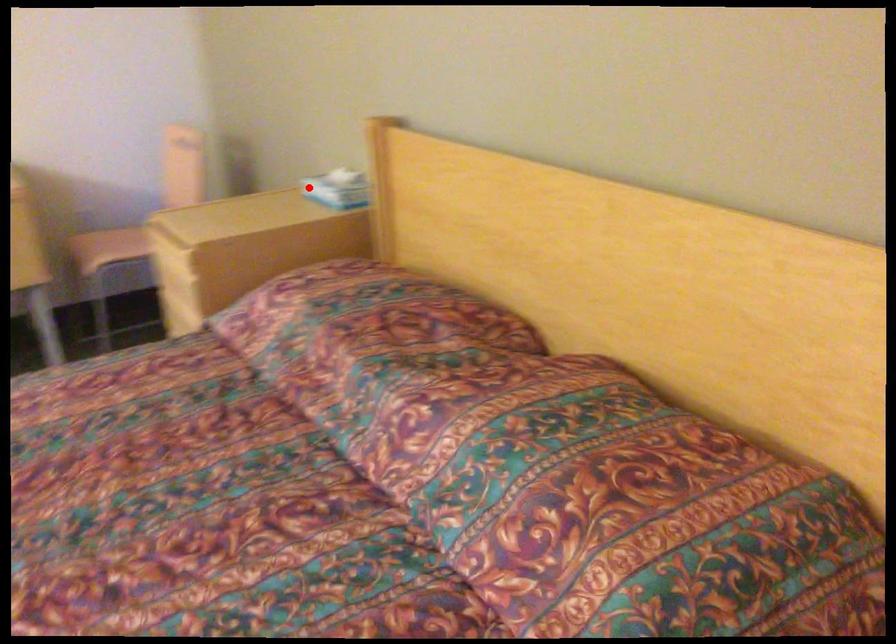
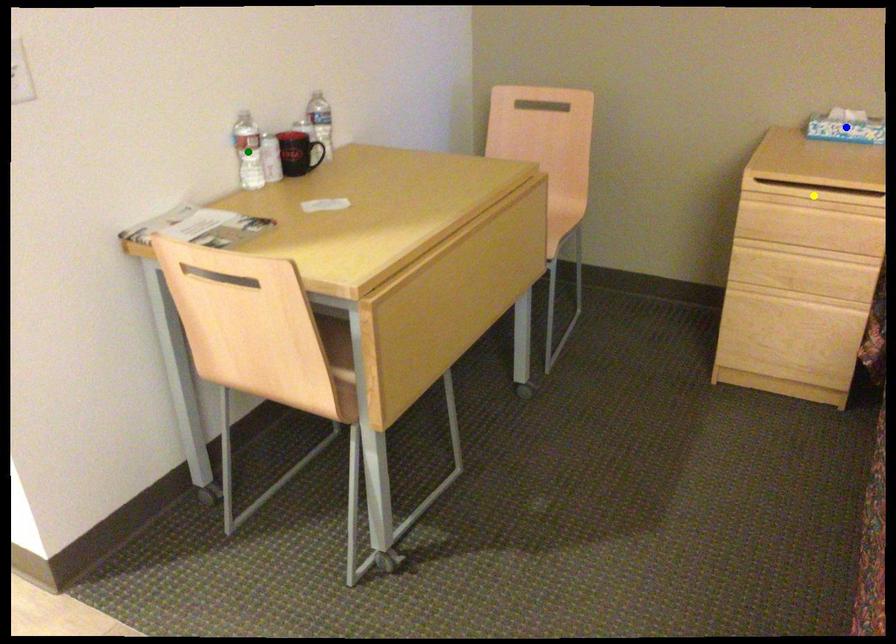
Question: I am providing you with two images of the same scene from different viewpoints. A red point is marked on the first image. You are given multiple points on the second image. Which point in image 2 represents the same 3d spot as the red point in image 1?

Choices:
 (A) green point
 (B) yellow point
 (C) blue point

Answer: (C)